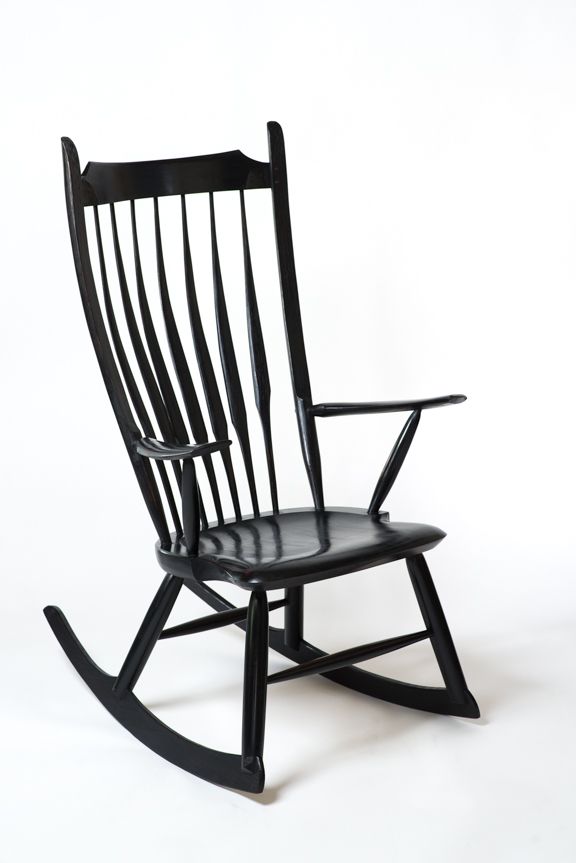
Where is `slats that make up the back of the chair`? slats that make up the back of the chair is located at coordinates (117, 337), (141, 350), (147, 326), (174, 324), (195, 318), (223, 316), (256, 320).